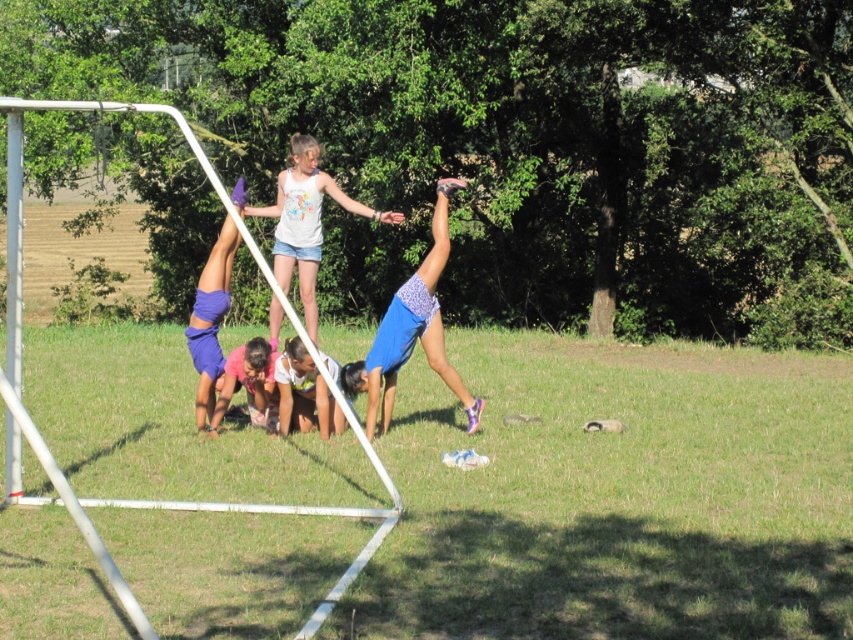
You are a photographer standing at the edge of the field, and you want to capture a photo that includes both the purple fabric shorts at left and the pink fabric at lower center. Given that your camera has a maximum focus range of 60 centimeters, will you be able to fit both objects in the frame without moving closer?

The distance between the purple fabric shorts at left and the pink fabric at lower center is 59.95 centimeters, which is just under the camera maximum focus range of 60 centimeters. Therefore, you can fit both objects in the frame without moving closer.

You are a photographer trying to capture a photo of the purple fabric shorts at left and the pink fabric at lower center. Based on their heights, which object should you focus on first if you want to ensure both are in the frame without adjusting your camera angle?

The purple fabric shorts at left has a lesser height compared to pink fabric at lower center. Therefore, you should focus on the pink fabric at lower center first to ensure both are in the frame since it is taller and might be more visible from your current angle.

You are a photographer setting up a camera to capture the acrobats in the park. You notice the blue fabric shorts at center and the white cotton tank top at upper center. Which clothing item appears wider in the frame?

The blue fabric shorts at center appears wider than the white cotton tank top at upper center.